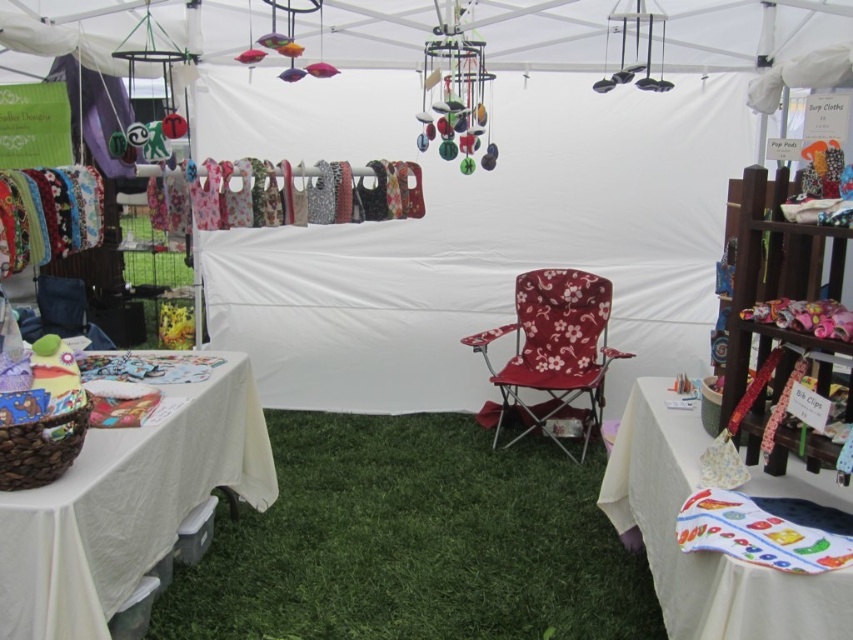
You are setting up a new display in the tent and need to place a decorative item between the green artificial turf at center and the white fabric table at lower left. Based on their positions, which object should the decorative item be closer to?

The decorative item should be closer to the white fabric table at lower left because the green artificial turf at center is positioned to the right of the white fabric table at lower left, meaning the table is to the left of the turf. Therefore, placing the decorative item between them would require it to be closer to the table on the left side.

You are a customer at the outdoor market and want to compare the items on the white fabric table at lower left and the printed fabric tablecloth at center. Which table is positioned further to the left?

The white fabric table at lower left is positioned to the left of the printed fabric tablecloth at center, so it is further to the left.